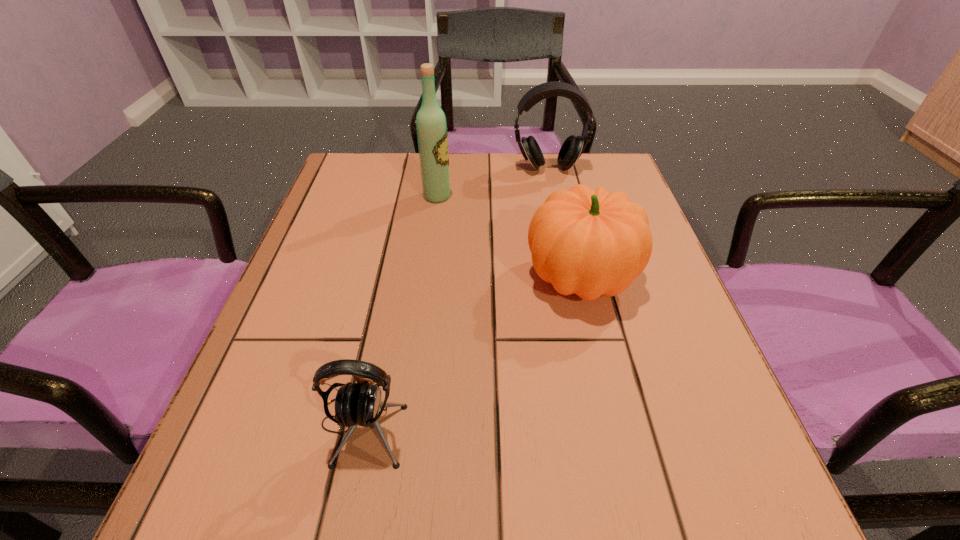
Where is `vacant space located 0.050m on the back of the nearer earphone`? vacant space located 0.050m on the back of the nearer earphone is located at coordinates (374, 362).

Where is `wine bottle that is at the far edge`? wine bottle that is at the far edge is located at coordinates (432, 135).

Find the location of `earphone present at the far edge`. earphone present at the far edge is located at coordinates (572, 148).

Where is `object positioned at the near edge`? The height and width of the screenshot is (540, 960). object positioned at the near edge is located at coordinates (359, 403).

Find the location of a particular element. Image resolution: width=960 pixels, height=540 pixels. object located at the left edge is located at coordinates (359, 403).

Identify the location of earphone located in the right edge section of the desktop. (572, 148).

What are the coordinates of `pumpkin at the right edge` in the screenshot? It's located at (587, 242).

You are a GUI agent. You are given a task and a screenshot of the screen. Output one action in this format:
    pyautogui.click(x=<x>, y=<y>)
    Task: Click on the object that is at the near left corner
    
    Given the screenshot: What is the action you would take?
    pyautogui.click(x=359, y=403)

This screenshot has width=960, height=540. I want to click on object at the far right corner, so click(572, 148).

This screenshot has height=540, width=960. Identify the location of blank area at the far edge. (476, 179).